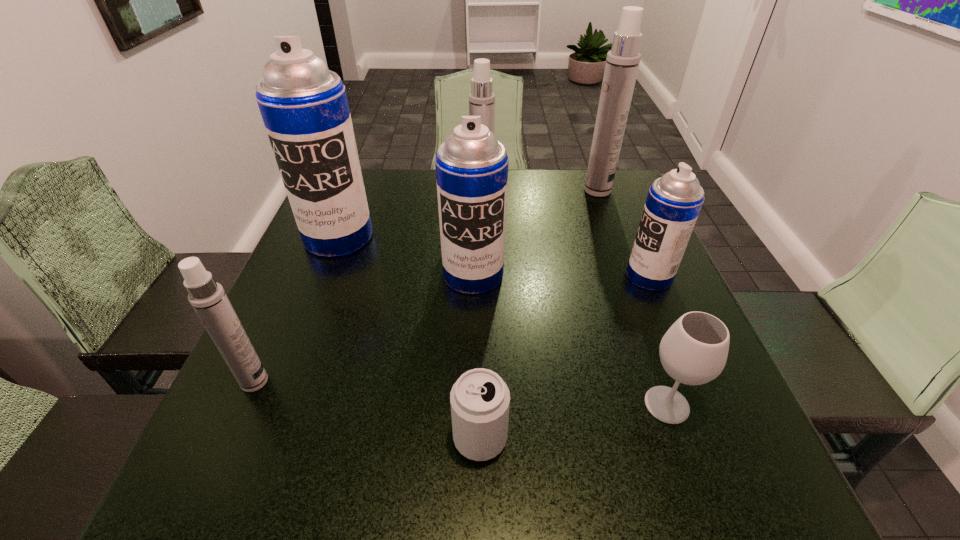
This screenshot has height=540, width=960. Identify the location of free space located 0.220m on the label side of the biggest blue aerosol can. (301, 332).

Find the location of a particular element. free space located on the left of the second biggest white aerosol can is located at coordinates (419, 201).

You are a GUI agent. You are given a task and a screenshot of the screen. Output one action in this format:
    pyautogui.click(x=<x>, y=<y>)
    Task: Click on the free space located on the label side of the second smallest blue aerosol can
    The width and height of the screenshot is (960, 540).
    Given the screenshot: What is the action you would take?
    pyautogui.click(x=472, y=336)

Find the location of `vacant space located on the label side of the rightmost blue aerosol can`. vacant space located on the label side of the rightmost blue aerosol can is located at coordinates (604, 276).

This screenshot has height=540, width=960. In order to click on free spot located on the label side of the rightmost blue aerosol can in this screenshot , I will do `click(476, 276)`.

Locate an element on the screen. This screenshot has height=540, width=960. free space located 0.210m on the label side of the rightmost blue aerosol can is located at coordinates (531, 276).

Locate an element on the screen. vacant space situated on the back of the nearest white aerosol can is located at coordinates (288, 306).

Where is `vacant space located 0.160m on the back of the second shortest object`? This screenshot has height=540, width=960. vacant space located 0.160m on the back of the second shortest object is located at coordinates (635, 315).

Identify the location of free location located on the back of the shortest object. (480, 261).

Where is `object that is at the near edge`? The width and height of the screenshot is (960, 540). object that is at the near edge is located at coordinates (480, 400).